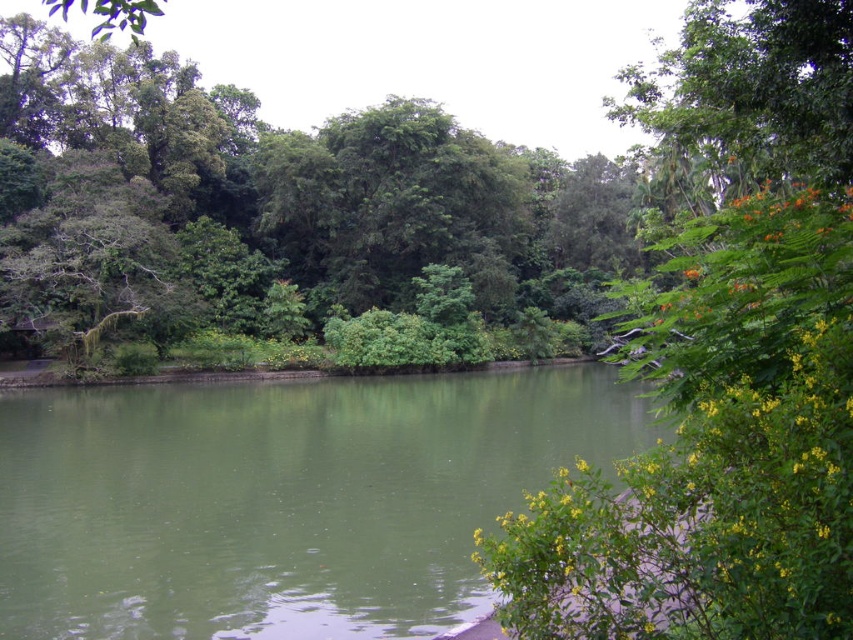
Does green smooth water at center have a lesser width compared to green leafy trees at upper center?

Indeed, green smooth water at center has a lesser width compared to green leafy trees at upper center.

Does point (183, 440) lie behind point (222, 204)?

No, (183, 440) is in front of (222, 204).

This screenshot has width=853, height=640. Describe the element at coordinates (281, 499) in the screenshot. I see `green smooth water at center` at that location.

Locate an element on the screen. The height and width of the screenshot is (640, 853). green smooth water at center is located at coordinates (281, 499).